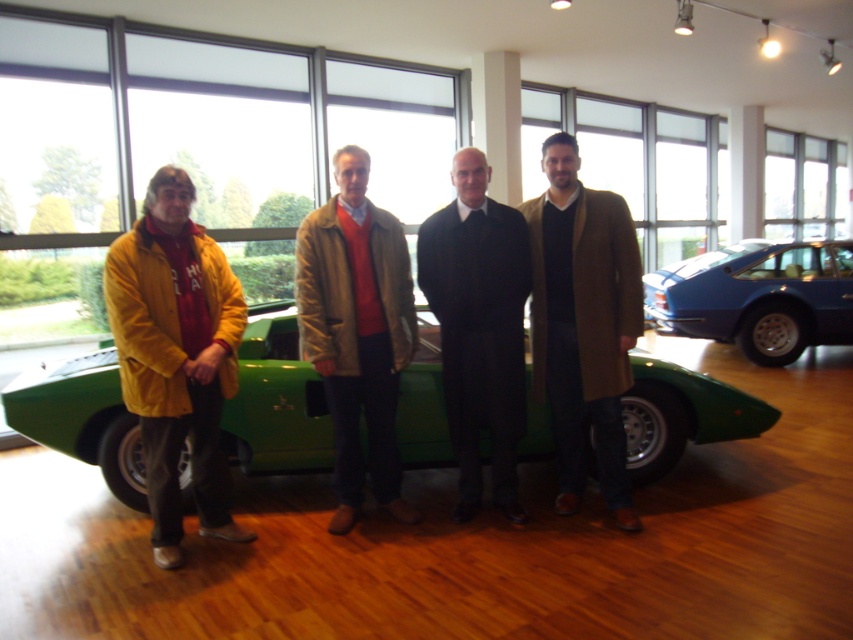
Does yellow suede jacket at left have a lesser width compared to matte brown coat at center?

Indeed, yellow suede jacket at left has a lesser width compared to matte brown coat at center.

The width and height of the screenshot is (853, 640). What do you see at coordinates (177, 355) in the screenshot?
I see `yellow suede jacket at left` at bounding box center [177, 355].

The width and height of the screenshot is (853, 640). Identify the location of yellow suede jacket at left. (177, 355).

Which is more to the left, yellow suede jacket at left or brown wool coat at center?

yellow suede jacket at left is more to the left.

Is yellow suede jacket at left to the left of brown wool coat at center from the viewer's perspective?

Correct, you'll find yellow suede jacket at left to the left of brown wool coat at center.

Is point (148, 388) positioned in front of point (566, 508)?

That is True.

Find the location of `yellow suede jacket at left`. yellow suede jacket at left is located at coordinates (177, 355).

Based on the photo, measure the distance between matte brown coat at center and blue metallic car at right.

matte brown coat at center is 4.33 meters from blue metallic car at right.

Is matte brown coat at center taller than blue metallic car at right?

Yes.

Is point (369, 308) less distant than point (704, 314)?

Yes, it is in front of point (704, 314).

Locate an element on the screen. matte brown coat at center is located at coordinates (357, 332).